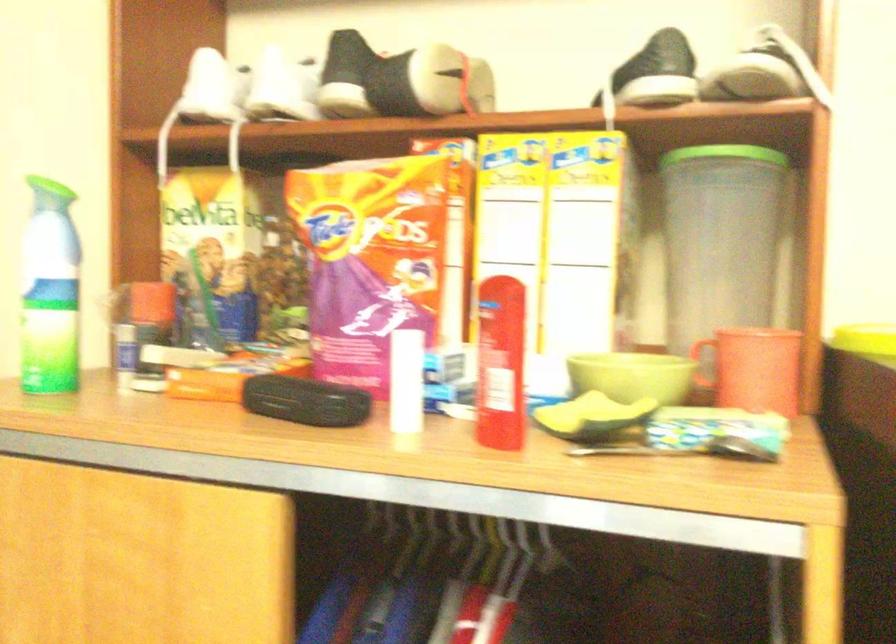
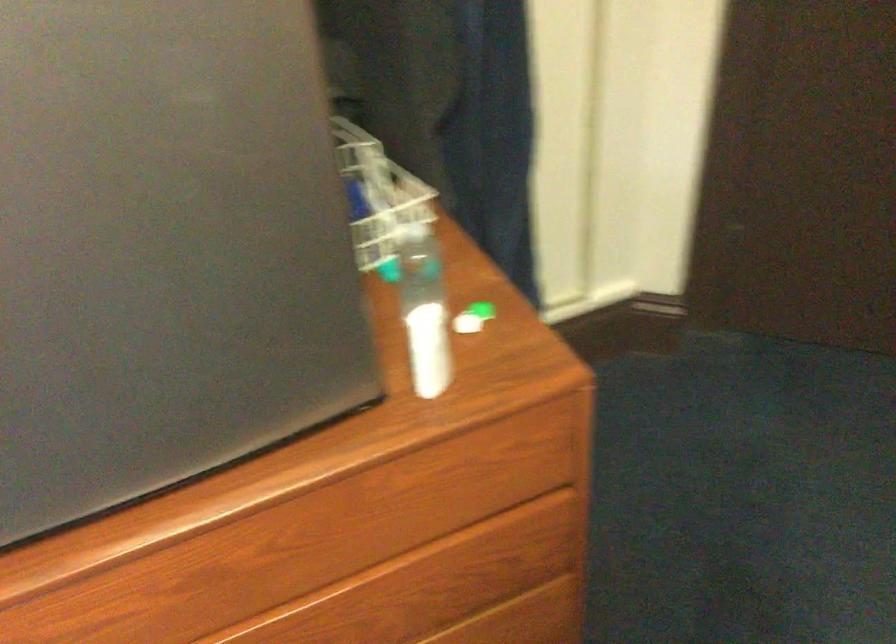
How did the camera likely rotate?

The camera rotated toward right-down.